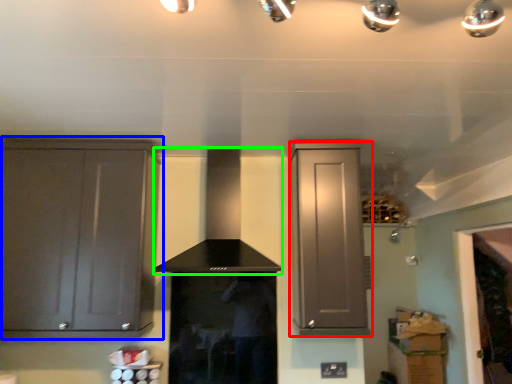
Question: Based on their relative distances, which object is nearer to cabinetry (highlighted by a red box)? Choose from cabinetry (highlighted by a blue box) and vent (highlighted by a green box).

Choices:
 (A) cabinetry
 (B) vent

Answer: (B)